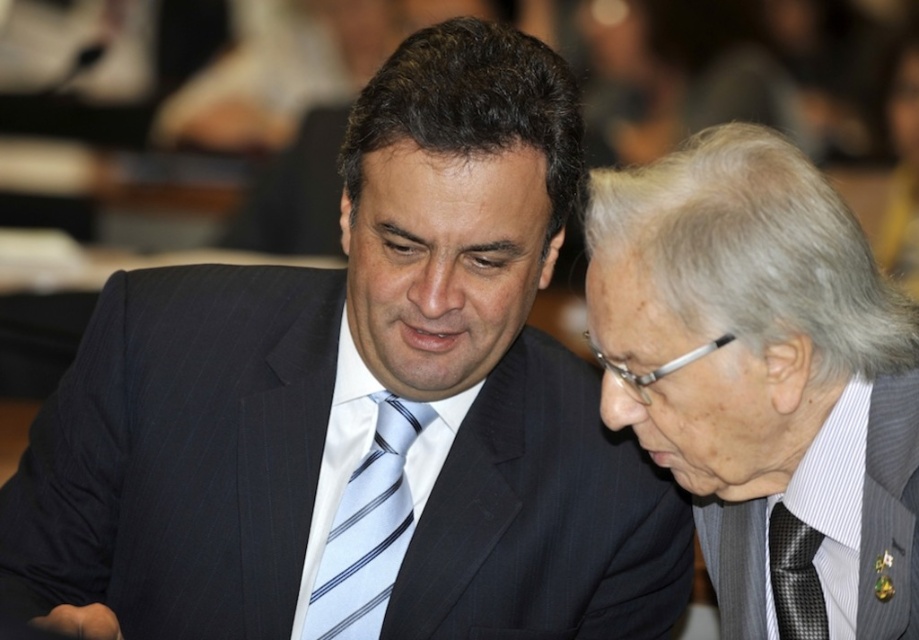
Question: Which object is closer to the camera taking this photo?

Choices:
 (A) dark blue pinstripe suit at center
 (B) black textured tie at lower right

Answer: (A)

Question: Is light blue striped tie at center bigger than black textured tie at lower right?

Choices:
 (A) yes
 (B) no

Answer: (A)

Question: Is gray textured suit at right wider than black textured tie at lower right?

Choices:
 (A) no
 (B) yes

Answer: (B)

Question: Among these points, which one is nearest to the camera?

Choices:
 (A) (390, 404)
 (B) (250, 364)
 (C) (792, 536)

Answer: (C)

Question: Which is farther from the light blue striped tie at center?

Choices:
 (A) gray textured suit at right
 (B) black textured tie at lower right
 (C) dark blue pinstripe suit at center

Answer: (B)

Question: Is dark blue pinstripe suit at center positioned at the back of gray textured suit at right?

Choices:
 (A) yes
 (B) no

Answer: (A)